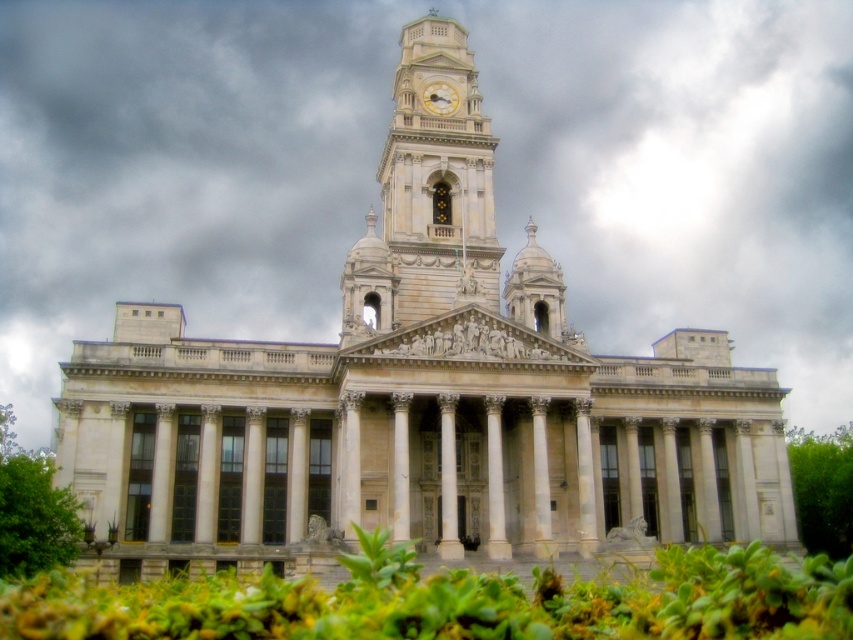
You are standing in front of the grand neoclassical building and want to place a decorative statue exactly at the center of the image. Considering the green leafy bush at lower left, where should you position the statue relative to the bush?

The green leafy bush at lower left is located at coordinates approximately 0.809 on the x axis and 0.041 on the y axis. To place the statue at the center of the image, you should position it to the upper right of the green leafy bush at lower left since the center is at coordinates 0.5 on the x axis and 0.5 on the y axis. Wait, actually, in image coordinates, the origin is usually at the top left corner. So the center would be at (426, 320). The bush is at (33, 516) which is near the top right? Wait, no. If

You are a photographer standing in front of the grand neoclassical building. You want to capture a photo that includes both the green leafy bush at lower left and the gold metallic clock at upper center. Given that your camera has a maximum focus range of 150 feet, will you be able to capture both objects in focus simultaneously?

The green leafy bush at lower left and gold metallic clock at upper center are 157.96 feet apart from each other. Since the distance exceeds the camera maximum focus range of 150 feet, you cannot capture both objects in focus simultaneously.